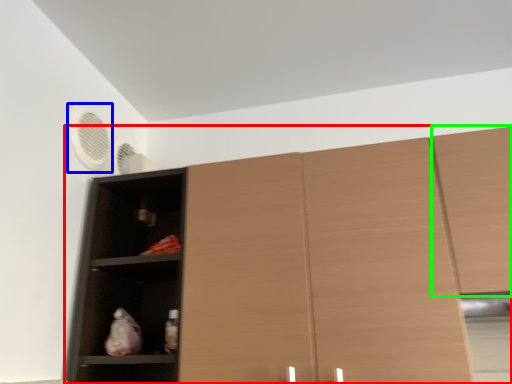
Question: Based on their relative distances, which object is nearer to cupboard (highlighted by a red box)? Choose from fan (highlighted by a blue box) and cabinetry (highlighted by a green box).

Choices:
 (A) fan
 (B) cabinetry

Answer: (B)